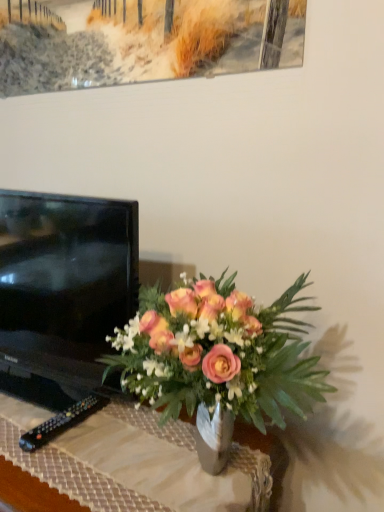
Question: Considering the positions of matte glass vase at center and black glossy tv at left in the image, is matte glass vase at center bigger or smaller than black glossy tv at left?

Choices:
 (A) big
 (B) small

Answer: (B)

Question: Considering the positions of matte glass vase at center and black glossy tv at left in the image, is matte glass vase at center wider or thinner than black glossy tv at left?

Choices:
 (A) thin
 (B) wide

Answer: (B)

Question: Based on their relative distances, which object is farther from the matte glass vase at center?

Choices:
 (A) black glossy tv at left
 (B) black plastic remote at lower left
 (C) matte glass vase at center

Answer: (A)

Question: Based on their relative distances, which object is nearer to the matte glass vase at center?

Choices:
 (A) black plastic remote at lower left
 (B) matte glass vase at center
 (C) black glossy tv at left

Answer: (B)